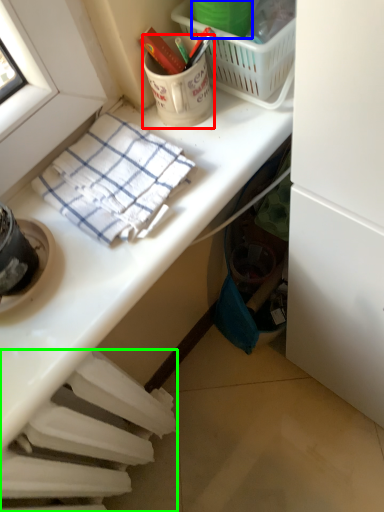
Question: Considering the real-world distances, which object is closest to coffee cup (highlighted by a red box)? bucket (highlighted by a blue box) or radiator (highlighted by a green box).

Choices:
 (A) bucket
 (B) radiator

Answer: (A)